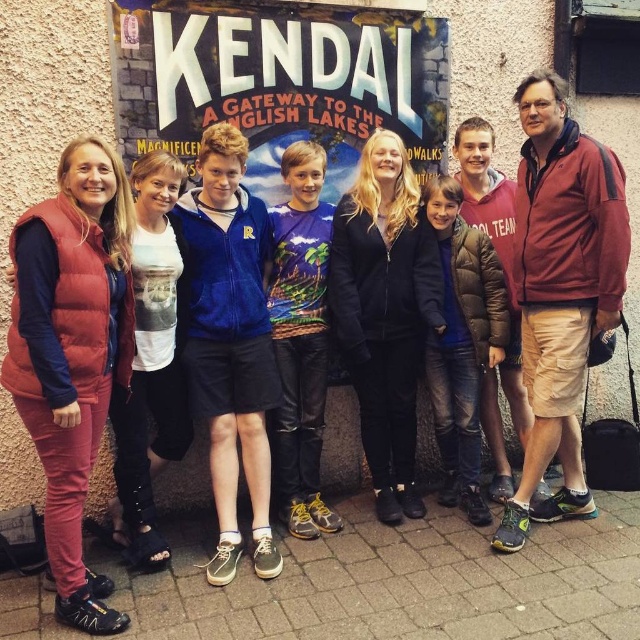
Between point (179, 264) and point (296, 154), which one is positioned behind?

Positioned behind is point (296, 154).

Who is positioned more to the right, white cotton t-shirt at center or printed jersey at center?

From the viewer's perspective, printed jersey at center appears more on the right side.

Describe the element at coordinates (150, 362) in the screenshot. I see `white cotton t-shirt at center` at that location.

Identify the location of white cotton t-shirt at center. This screenshot has width=640, height=640. (150, 362).

Between point (212, 582) and point (476, 522), which one is positioned behind?

The point (476, 522) is more distant.

Between blue velour jacket at center and dark brown puffer jacket at center, which one has more height?

Standing taller between the two is blue velour jacket at center.

Measure the distance between point (264, 464) and camera.

Point (264, 464) and camera are 3.49 meters apart from each other.

Find the location of `blue velour jacket at center`. blue velour jacket at center is located at coordinates (230, 342).

Can you confirm if matte signboard at center is positioned below printed jersey at center?

Actually, matte signboard at center is above printed jersey at center.

Who is shorter, matte signboard at center or printed jersey at center?

matte signboard at center

In order to click on matte signboard at center in this screenshot , I will do `click(280, 83)`.